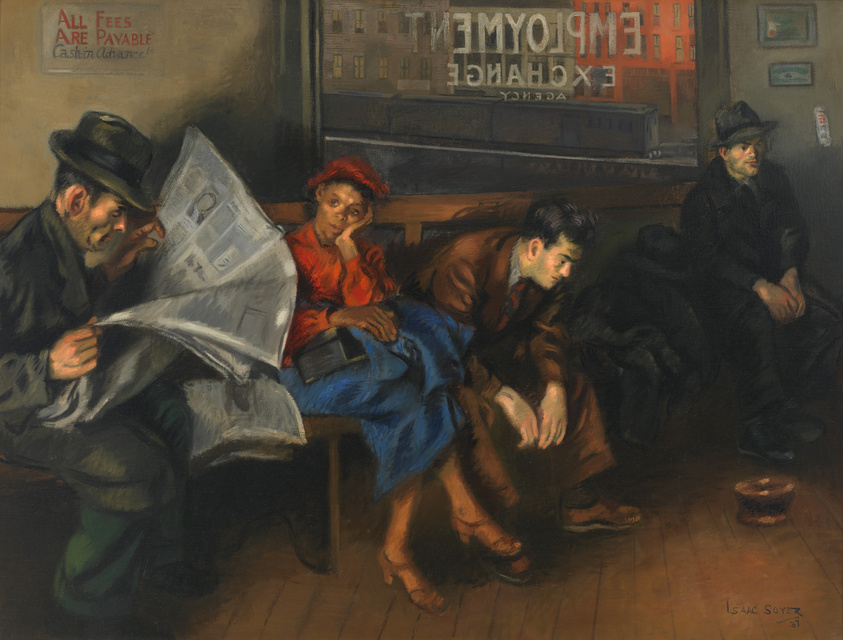
The width and height of the screenshot is (843, 640). I want to click on bench, so click(407, 216).